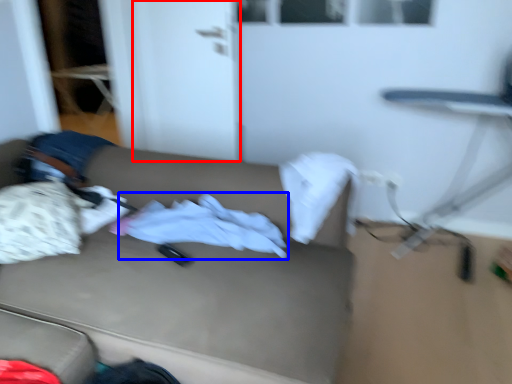
Question: Which point is further to the camera, door (highlighted by a red box) or baby clothe (highlighted by a blue box)?

Choices:
 (A) door
 (B) baby clothe

Answer: (A)